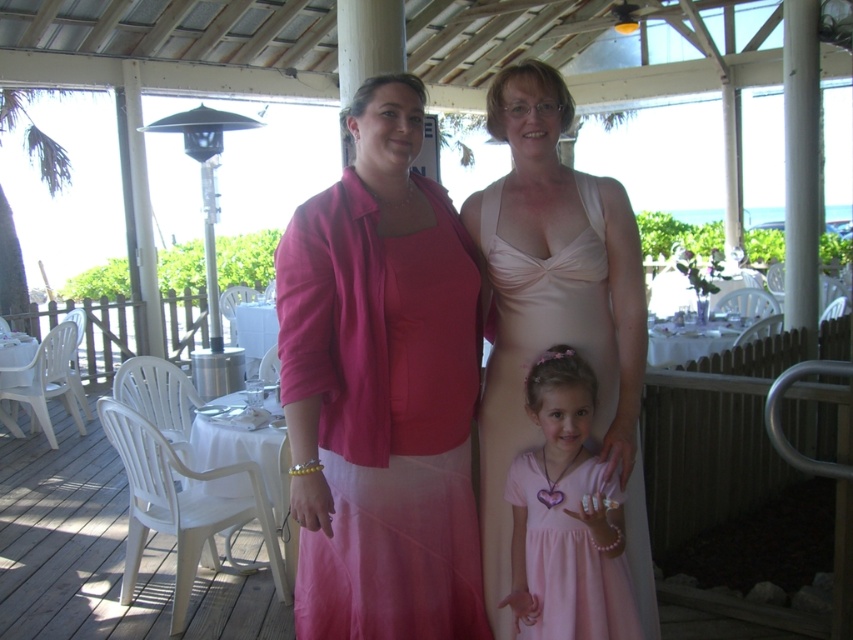
Is point (509, 285) in front of point (512, 496)?

Yes.

The height and width of the screenshot is (640, 853). Find the location of `satin beige dress at center`. satin beige dress at center is located at coordinates (x=556, y=314).

You are a GUI agent. You are given a task and a screenshot of the screen. Output one action in this format:
    pyautogui.click(x=<x>, y=<y>)
    Task: Click on the satin beige dress at center
    Image resolution: width=853 pixels, height=640 pixels.
    Given the screenshot: What is the action you would take?
    pyautogui.click(x=556, y=314)

Does matte pink dress at center have a lesser width compared to satin beige dress at center?

Yes.

Between matte pink dress at center and satin beige dress at center, which one has more height?

Standing taller between the two is satin beige dress at center.

Who is more distant from viewer, (314,429) or (642,531)?

Point (642,531)

You are a GUI agent. You are given a task and a screenshot of the screen. Output one action in this format:
    pyautogui.click(x=<x>, y=<y>)
    Task: Click on the matte pink dress at center
    The image size is (853, 640).
    Given the screenshot: What is the action you would take?
    pyautogui.click(x=381, y=388)

Does matte pink dress at center have a larger size compared to pink satin dress at center?

Correct, matte pink dress at center is larger in size than pink satin dress at center.

Who is positioned more to the right, matte pink dress at center or pink satin dress at center?

Positioned to the right is pink satin dress at center.

Is point (422, 602) positioned before point (607, 541)?

No, (422, 602) is behind (607, 541).

Find the location of a particular element. This screenshot has width=853, height=640. matte pink dress at center is located at coordinates (381, 388).